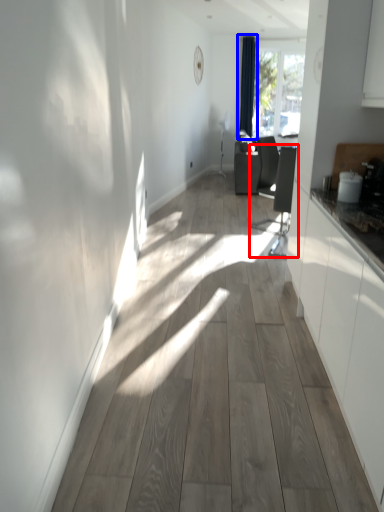
Question: Among these objects, which one is nearest to the camera, swivel chair (highlighted by a red box) or curtain (highlighted by a blue box)?

Choices:
 (A) swivel chair
 (B) curtain

Answer: (A)